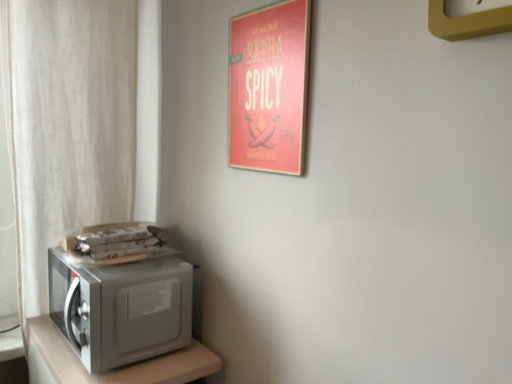
Question: Is white sheer curtain at left taller or shorter than yellow plastic clock at upper right?

Choices:
 (A) tall
 (B) short

Answer: (A)

Question: From a real-world perspective, is white sheer curtain at left physically located above or below yellow plastic clock at upper right?

Choices:
 (A) below
 (B) above

Answer: (A)

Question: Which is farther from the yellow plastic clock at upper right?

Choices:
 (A) satin silver microwave at left
 (B) white sheer curtain at left
 (C) satin silver microwave at lower left

Answer: (B)

Question: Which of these objects is positioned farthest from the satin silver microwave at lower left?

Choices:
 (A) satin silver microwave at left
 (B) yellow plastic clock at upper right
 (C) white sheer curtain at left

Answer: (B)